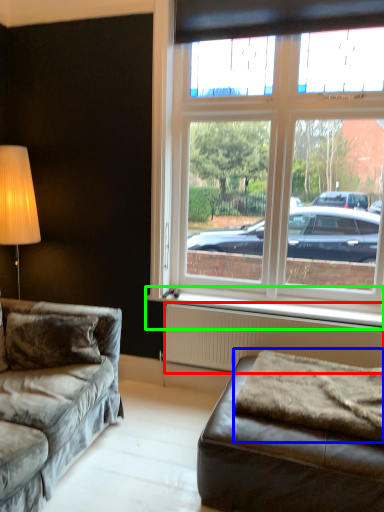
Question: Which object is positioned farthest from radiator (highlighted by a red box)? Select from blanket (highlighted by a blue box) and window sill (highlighted by a green box).

Choices:
 (A) blanket
 (B) window sill

Answer: (A)